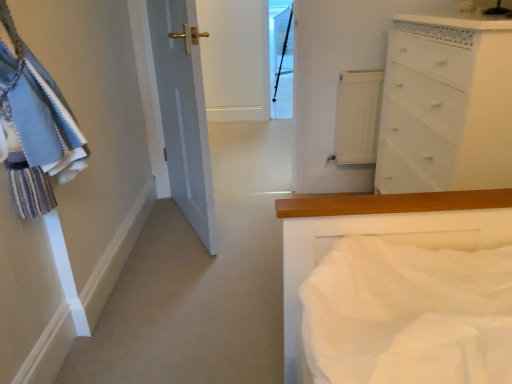
Question: In the image, is white painted wood chest of drawers at upper right positioned in front of or behind transparent glass door at upper center?

Choices:
 (A) front
 (B) behind

Answer: (A)

Question: Is white painted wood chest of drawers at upper right spatially inside transparent glass door at upper center, or outside of it?

Choices:
 (A) outside
 (B) inside

Answer: (A)

Question: Which object is the closest to the white painted wood chest of drawers at upper right?

Choices:
 (A) transparent glass door at upper center
 (B) white wood radiator at upper center

Answer: (B)

Question: Which is farther from the white wood radiator at upper center?

Choices:
 (A) white painted wood chest of drawers at upper right
 (B) transparent glass door at upper center

Answer: (B)